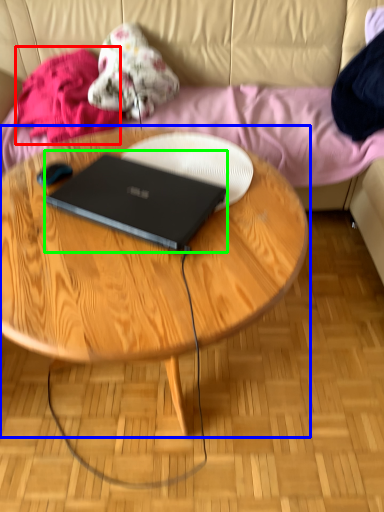
Question: Which is nearer to the clothing (highlighted by a red box)? coffee table (highlighted by a blue box) or laptop (highlighted by a green box).

Choices:
 (A) coffee table
 (B) laptop

Answer: (A)